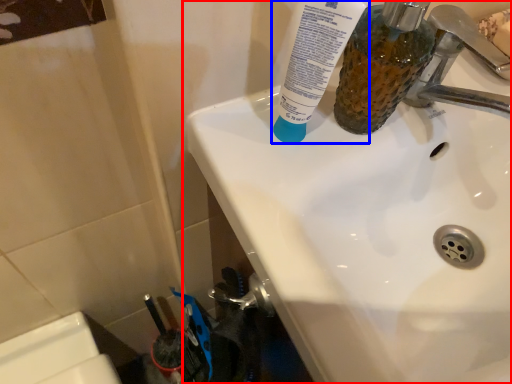
Question: Which object appears closest to the camera in this image, sink (highlighted by a red box) or toothpaste (highlighted by a blue box)?

Choices:
 (A) sink
 (B) toothpaste

Answer: (A)